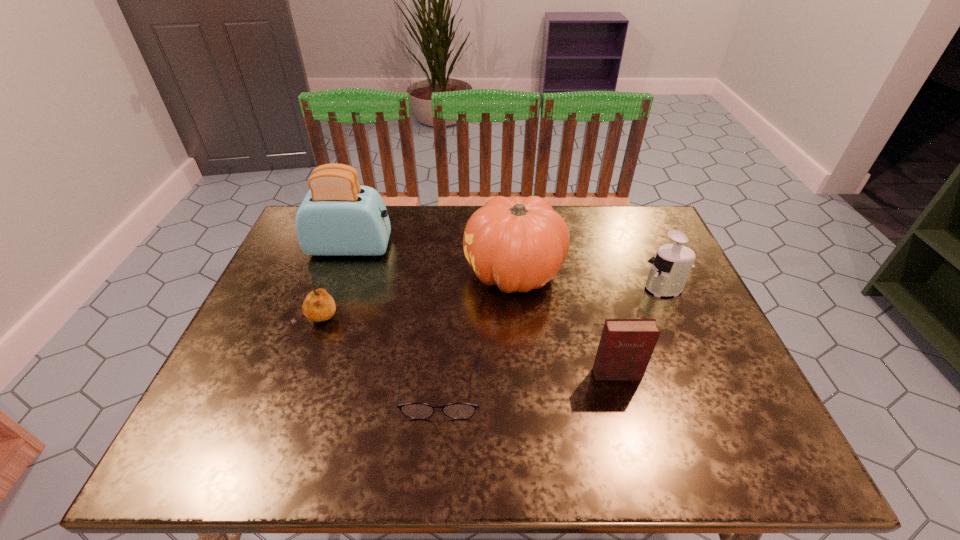
This screenshot has height=540, width=960. What are the coordinates of `unoccupied area between the toaster and the fifth tallest object` in the screenshot? It's located at (335, 284).

You are a GUI agent. You are given a task and a screenshot of the screen. Output one action in this format:
    pyautogui.click(x=<x>, y=<y>)
    Task: Click on the vacant space in between the second tallest object and the second object from right to left
    The width and height of the screenshot is (960, 540).
    Given the screenshot: What is the action you would take?
    pyautogui.click(x=565, y=323)

Where is `free space between the tallest object and the diary`? This screenshot has width=960, height=540. free space between the tallest object and the diary is located at coordinates (484, 310).

Locate an element on the screen. The width and height of the screenshot is (960, 540). object that is the third closest to the pumpkin is located at coordinates (670, 269).

Select which object appears as the fourth closest to the second shortest object. Please provide its 2D coordinates. Your answer should be formatted as a tuple, i.e. [(x, y)], where the tuple contains the x and y coordinates of a point satisfying the conditions above.

[(626, 345)]

Find the location of a particular element. vacant area in the image that satisfies the following two spatial constraints: 1. on the side of the juicer with the lever; 2. on the right side of the tallest object is located at coordinates (337, 288).

The height and width of the screenshot is (540, 960). What are the coordinates of `free space that satisfies the following two spatial constraints: 1. on the side of the toaster with the lever; 2. on the back side of the rightmost object` in the screenshot? It's located at (337, 288).

This screenshot has width=960, height=540. Find the location of `vacant space that satisfies the following two spatial constraints: 1. on the side of the tallest object with the lever; 2. on the front side of the fifth tallest object`. vacant space that satisfies the following two spatial constraints: 1. on the side of the tallest object with the lever; 2. on the front side of the fifth tallest object is located at coordinates (326, 320).

Where is `vacant region that satisfies the following two spatial constraints: 1. on the back side of the juicer; 2. on the carved face of the pumpkin`? The width and height of the screenshot is (960, 540). vacant region that satisfies the following two spatial constraints: 1. on the back side of the juicer; 2. on the carved face of the pumpkin is located at coordinates (658, 273).

This screenshot has width=960, height=540. I want to click on free point that satisfies the following two spatial constraints: 1. on the carved face of the fifth shortest object; 2. on the back side of the rightmost object, so click(516, 288).